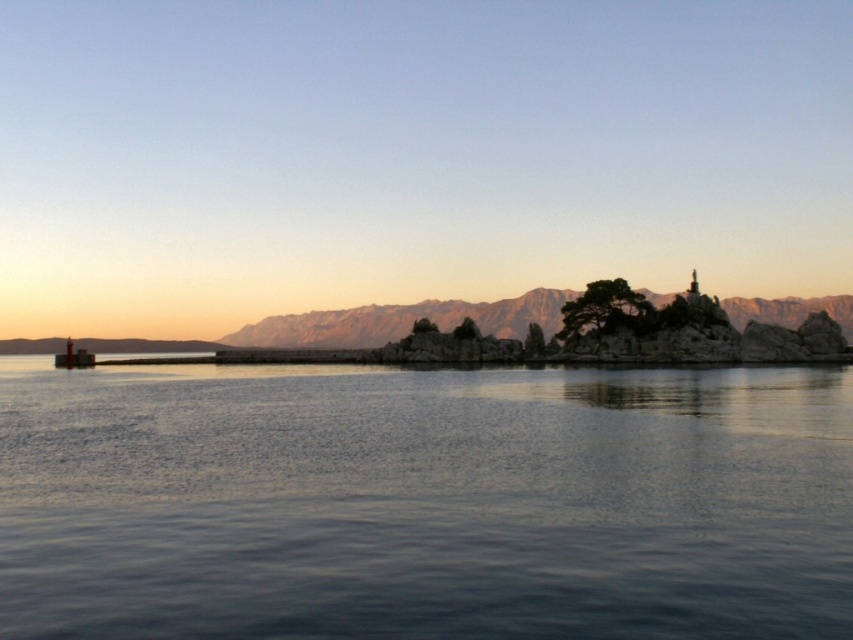
What are the coordinates of the dark blue water at center?

The dark blue water at center is located at coordinates point (424, 502).